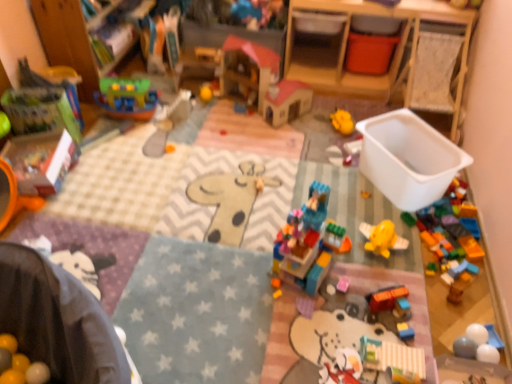
Locate an element on the screen. This screenshot has height=384, width=512. vacant space that is in between translucent plastic airplane at center, placed as the fourth toy when sorted from bottom to top, and orange matte car at center, arranged as the ninth toy when viewed from the top is located at coordinates (375, 256).